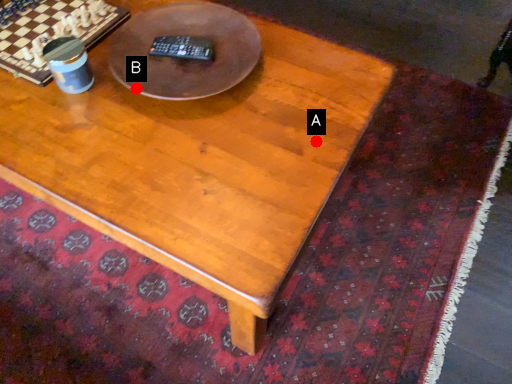
Question: Two points are circled on the image, labeled by A and B beside each circle. Which point is closer to the camera taking this photo?

Choices:
 (A) A is closer
 (B) B is closer

Answer: (A)